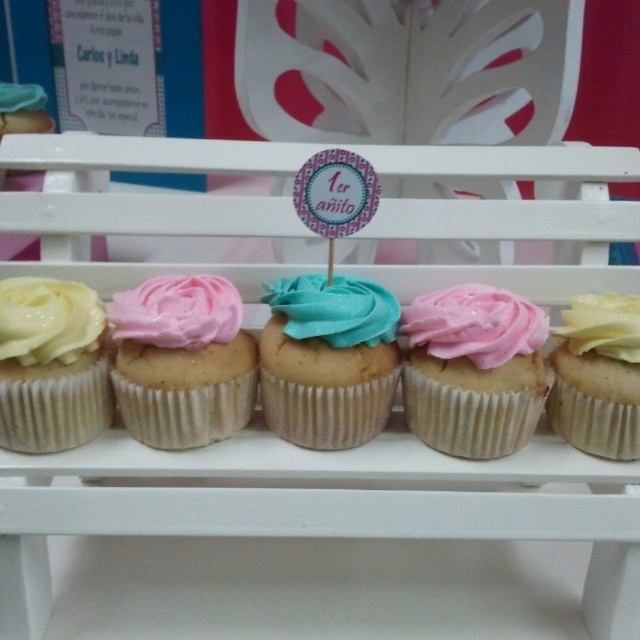
You are planning to take a cupcake from the shelf. You want to choose the taller one between the matte yellow cupcake at left and the yellow matte cupcake at right. Which one should you pick?

The matte yellow cupcake at left is taller than the yellow matte cupcake at right, so you should pick the matte yellow cupcake at left.

You are planning to take a cupcake from the shelf. The teal frosting cupcake at center has a height of 10 cm, and the white matte icing at right is only 5 cm tall. If you want to choose the taller one, which cupcake should you pick?

The teal frosting cupcake at center is much taller than the white matte icing at right, so you should pick the teal frosting cupcake at center.

In the scene shown: You are a customer at a bakery and want to order the teal frosting cupcake at center and the white matte icing at right. The cashier asks you to describe their positions relative to each other so they can locate them easily. How would you describe their positions?

The teal frosting cupcake at center is located below the white matte icing at right.